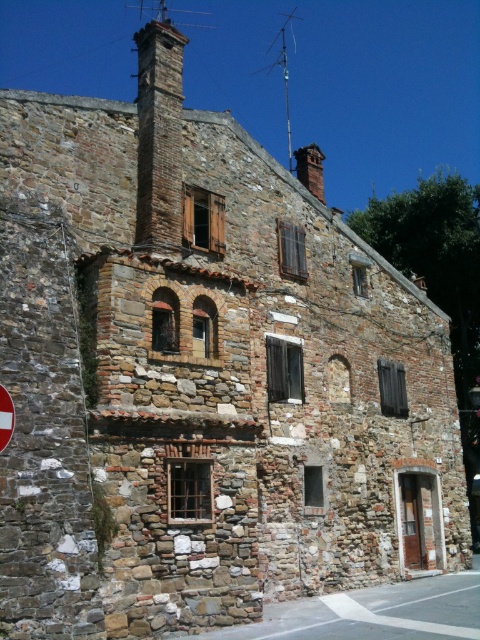
Between brown stone chimney at upper center and red plastic stop sign at left, which one has more height?

brown stone chimney at upper center

Can you confirm if brown stone chimney at upper center is smaller than red plastic stop sign at left?

No.

Find the location of `brown stone chimney at upper center`. brown stone chimney at upper center is located at coordinates (158, 134).

The width and height of the screenshot is (480, 640). What do you see at coordinates (158, 134) in the screenshot?
I see `brown stone chimney at upper center` at bounding box center [158, 134].

Which of these two, brown stone chimney at upper center or red brick chimney at upper center, stands shorter?

Standing shorter between the two is red brick chimney at upper center.

Is point (148, 170) positioned in front of point (314, 180)?

Yes, point (148, 170) is closer to viewer.

Find the location of a particular element. The height and width of the screenshot is (640, 480). brown stone chimney at upper center is located at coordinates (158, 134).

Is red plastic stop sign at left further to the viewer compared to metallic antenna at upper center?

No, it is in front of metallic antenna at upper center.

Is red plastic stop sign at left thinner than metallic antenna at upper center?

Correct, red plastic stop sign at left's width is less than metallic antenna at upper center's.

Is point (2, 444) more distant than point (287, 134)?

No, (2, 444) is closer to viewer.

You are a GUI agent. You are given a task and a screenshot of the screen. Output one action in this format:
    pyautogui.click(x=<x>, y=<y>)
    Task: Click on the red plastic stop sign at left
    
    Given the screenshot: What is the action you would take?
    pyautogui.click(x=6, y=417)